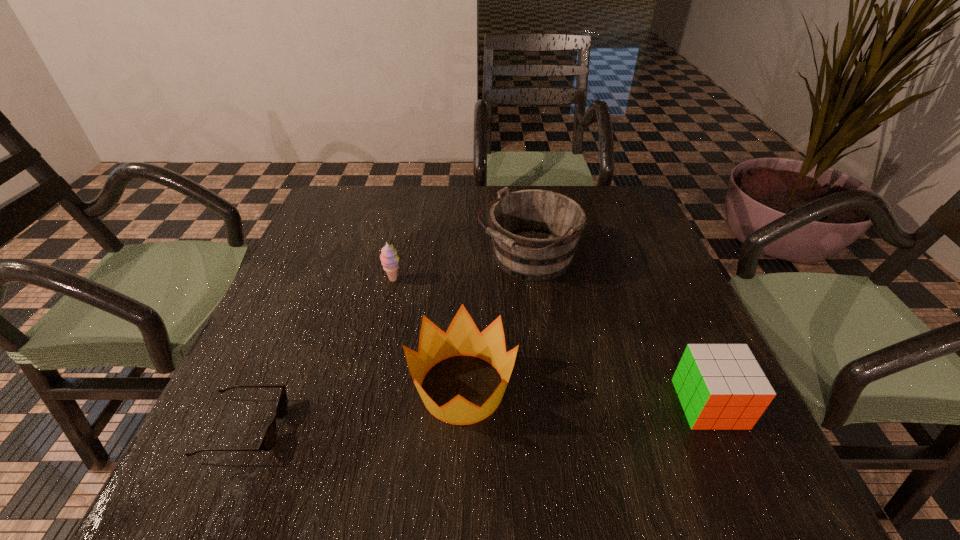
The width and height of the screenshot is (960, 540). In order to click on free space at the far left corner of the desktop in this screenshot , I will do `click(383, 185)`.

Where is `vacant point at the far right corner`? vacant point at the far right corner is located at coordinates (613, 215).

Find the location of a particular element. The width and height of the screenshot is (960, 540). free space at the near right corner of the desktop is located at coordinates (749, 442).

You are a GUI agent. You are given a task and a screenshot of the screen. Output one action in this format:
    pyautogui.click(x=<x>, y=<y>)
    Task: Click on the free space that is in between the tallest object and the shortest object
    Image resolution: width=960 pixels, height=540 pixels.
    Given the screenshot: What is the action you would take?
    pyautogui.click(x=386, y=343)

Locate an element on the screen. This screenshot has width=960, height=540. empty space that is in between the sherbert and the rightmost object is located at coordinates (551, 342).

Where is `free space between the sherbert and the tallest object`? Image resolution: width=960 pixels, height=540 pixels. free space between the sherbert and the tallest object is located at coordinates (461, 269).

Locate an element on the screen. free point between the cube and the tallest object is located at coordinates (619, 331).

I want to click on free space between the tallest object and the fourth object from right to left, so pos(461,269).

This screenshot has height=540, width=960. In order to click on free area in between the cube and the sherbert in this screenshot , I will do `click(551, 342)`.

Identify the location of vacant point located between the crown and the shortest object. This screenshot has height=540, width=960. (353, 408).